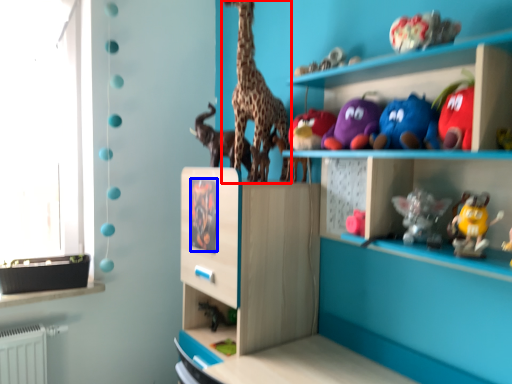
Question: Among these objects, which one is nearest to the camera, giraffe (highlighted by a red box) or animal (highlighted by a blue box)?

Choices:
 (A) giraffe
 (B) animal

Answer: (A)